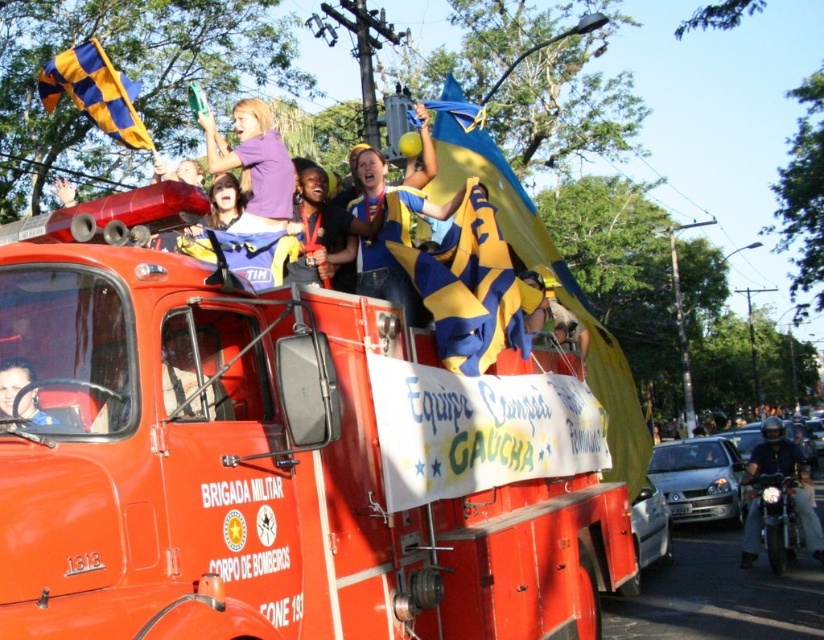
Is orange matte fire truck at center shorter than purple matte shirt at upper center?

In fact, orange matte fire truck at center may be taller than purple matte shirt at upper center.

Can you confirm if orange matte fire truck at center is positioned to the left of purple matte shirt at upper center?

In fact, orange matte fire truck at center is to the right of purple matte shirt at upper center.

Describe the element at coordinates (279, 458) in the screenshot. I see `orange matte fire truck at center` at that location.

You are a GUI agent. You are given a task and a screenshot of the screen. Output one action in this format:
    pyautogui.click(x=<x>, y=<y>)
    Task: Click on the orange matte fire truck at center
    The width and height of the screenshot is (824, 640).
    Given the screenshot: What is the action you would take?
    pyautogui.click(x=279, y=458)

Is blue/yellow jersey at center to the left of metallic silver helmet at driver's seat from the viewer's perspective?

In fact, blue/yellow jersey at center is to the right of metallic silver helmet at driver's seat.

Locate an element on the screen. The image size is (824, 640). blue/yellow jersey at center is located at coordinates click(x=394, y=220).

This screenshot has height=640, width=824. Identify the location of blue/yellow jersey at center. (394, 220).

Which is behind, point (378, 188) or point (762, 454)?

Point (762, 454)

This screenshot has height=640, width=824. In order to click on blue/yellow jersey at center in this screenshot , I will do `click(394, 220)`.